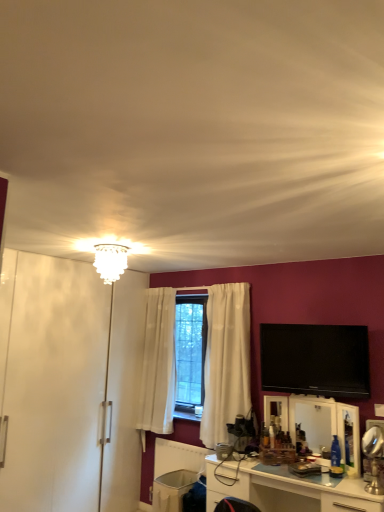
Question: Can you confirm if white plastic trash bin at lower center is wider than flat screen tv at upper right?

Choices:
 (A) no
 (B) yes

Answer: (B)

Question: From the image's perspective, is white plastic trash bin at lower center below flat screen tv at upper right?

Choices:
 (A) no
 (B) yes

Answer: (B)

Question: Does white plastic trash bin at lower center appear on the right side of flat screen tv at upper right?

Choices:
 (A) no
 (B) yes

Answer: (A)

Question: Is white plastic trash bin at lower center beside flat screen tv at upper right?

Choices:
 (A) no
 (B) yes

Answer: (A)

Question: From a real-world perspective, is white plastic trash bin at lower center on flat screen tv at upper right?

Choices:
 (A) yes
 (B) no

Answer: (B)

Question: In terms of size, does white glossy cabinet at lower center appear bigger or smaller than white glass chandelier at upper center?

Choices:
 (A) big
 (B) small

Answer: (A)

Question: Based on their positions, is white glossy cabinet at lower center located to the left or right of white glass chandelier at upper center?

Choices:
 (A) left
 (B) right

Answer: (B)

Question: Would you say white glossy cabinet at lower center is inside or outside white glass chandelier at upper center?

Choices:
 (A) outside
 (B) inside

Answer: (A)

Question: In terms of height, does white glossy cabinet at lower center look taller or shorter compared to white glass chandelier at upper center?

Choices:
 (A) tall
 (B) short

Answer: (A)

Question: Is flat screen tv at upper right wider or thinner than white glass chandelier at upper center?

Choices:
 (A) thin
 (B) wide

Answer: (A)

Question: Is flat screen tv at upper right in front of or behind white glass chandelier at upper center in the image?

Choices:
 (A) front
 (B) behind

Answer: (B)

Question: Is point (301, 351) closer or farther from the camera than point (104, 249)?

Choices:
 (A) closer
 (B) farther

Answer: (B)

Question: Is flat screen tv at upper right bigger or smaller than white glass chandelier at upper center?

Choices:
 (A) small
 (B) big

Answer: (B)

Question: In terms of size, does white glossy cabinet at lower center appear bigger or smaller than white glossy armoire at left?

Choices:
 (A) big
 (B) small

Answer: (B)

Question: Considering the positions of white glossy cabinet at lower center and white glossy armoire at left in the image, is white glossy cabinet at lower center wider or thinner than white glossy armoire at left?

Choices:
 (A) wide
 (B) thin

Answer: (B)